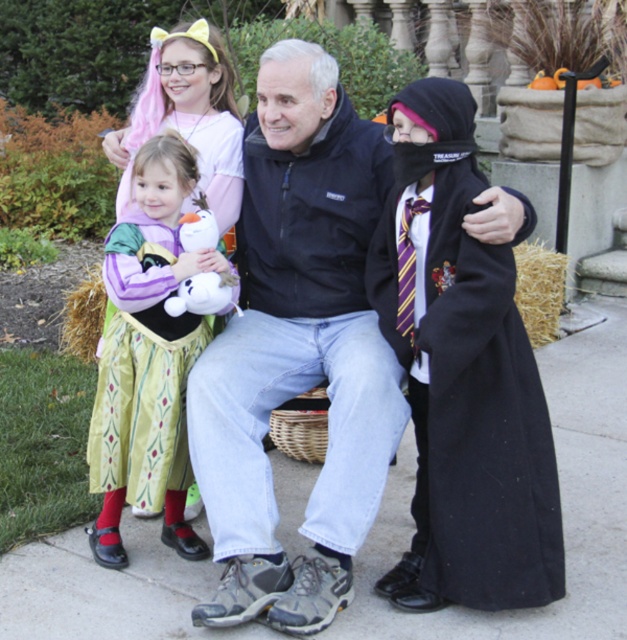
Question: Which is nearer to the black woolen robe at right?

Choices:
 (A) white plush toy at center
 (B) green satin dress at left
 (C) black softshell jacket at center

Answer: (C)

Question: Which point is closer to the camera?

Choices:
 (A) white plush toy at center
 (B) green satin dress at left

Answer: (B)

Question: Does black woolen robe at right have a lesser width compared to white plush toy at center?

Choices:
 (A) no
 (B) yes

Answer: (A)

Question: Which object appears farthest from the camera in this image?

Choices:
 (A) black woolen robe at right
 (B) black softshell jacket at center

Answer: (B)

Question: Does matte black coat at center have a lesser width compared to black woolen robe at right?

Choices:
 (A) no
 (B) yes

Answer: (A)

Question: Does black woolen robe at right have a smaller size compared to white plush toy at center?

Choices:
 (A) no
 (B) yes

Answer: (A)